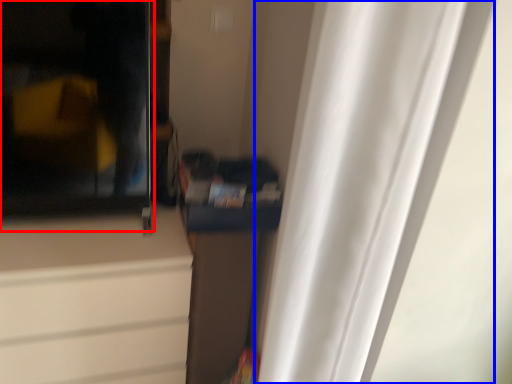
Question: Which of the following is the farthest to the observer, screen door (highlighted by a red box) or curtain (highlighted by a blue box)?

Choices:
 (A) screen door
 (B) curtain

Answer: (A)